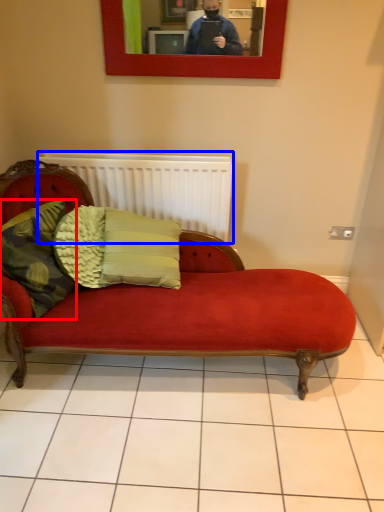
Question: Which object appears farthest to the camera in this image, pillow (highlighted by a red box) or radiator (highlighted by a blue box)?

Choices:
 (A) pillow
 (B) radiator

Answer: (B)